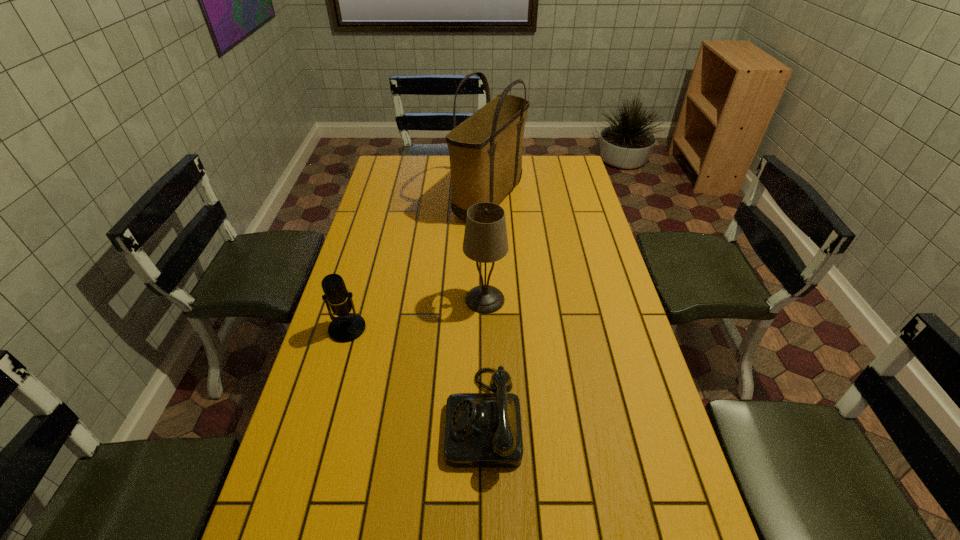
Identify the location of free location that satisfies the following two spatial constraints: 1. on the front side of the tallest object; 2. on the dial of the shortest object. pos(495,417).